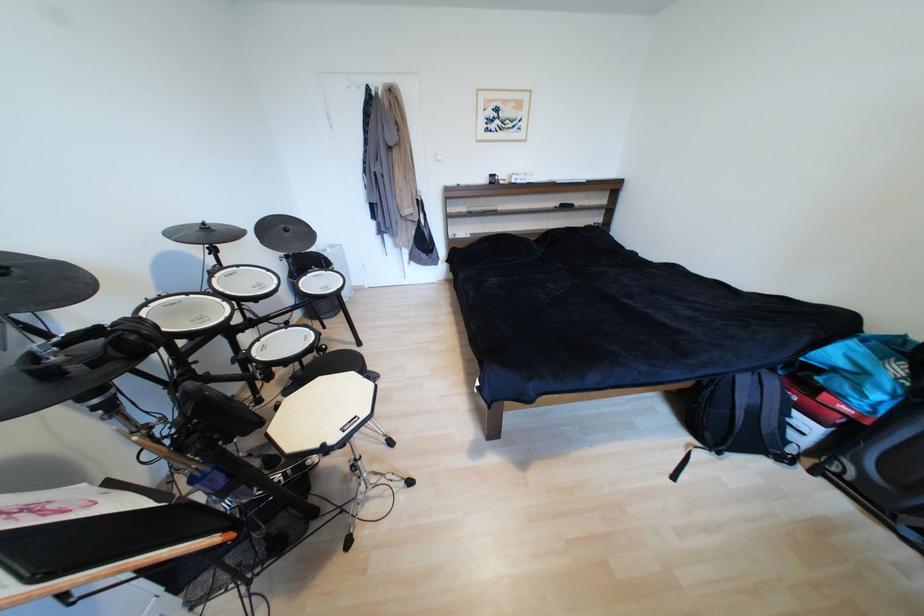
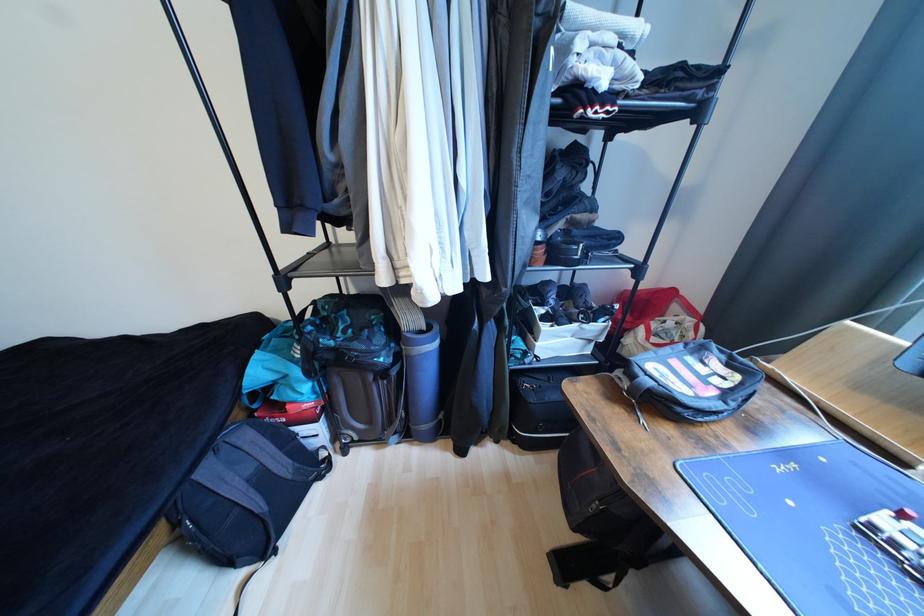
Where in the second image is the point corresponding to point 751,381 from the first image?

(215, 472)